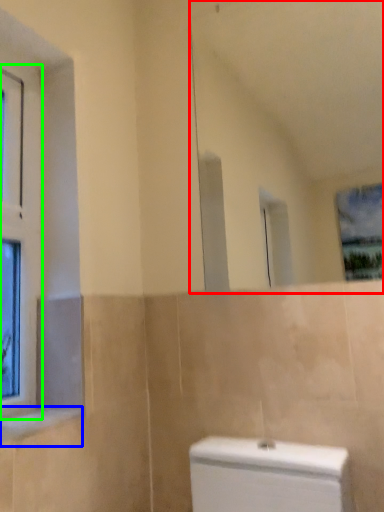
Question: Based on their relative distances, which object is farther from mirror (highlighted by a red box)? Choose from window sill (highlighted by a blue box) and window (highlighted by a green box).

Choices:
 (A) window sill
 (B) window

Answer: (A)